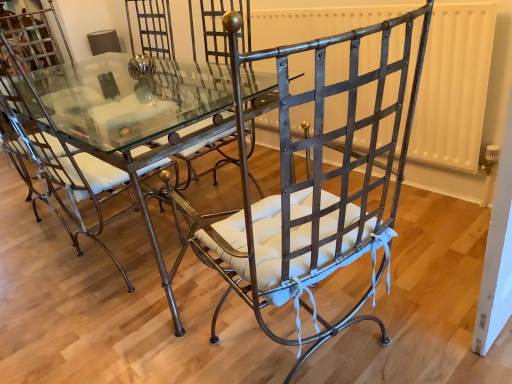
What is the approximate height of metallic wrought iron chair at center, which is the second chair in left-to-right order?

3.63 feet.

The height and width of the screenshot is (384, 512). Describe the element at coordinates (310, 185) in the screenshot. I see `metallic wrought iron chair at center, positioned as the first chair in right-to-left order` at that location.

This screenshot has height=384, width=512. Find the location of `clear glass table at center`. clear glass table at center is located at coordinates (118, 127).

Image resolution: width=512 pixels, height=384 pixels. Identify the location of wrought iron chair at center, which is the 1th chair from left to right. (61, 163).

Between point (339, 240) and point (116, 92), which one is positioned behind?

The point (116, 92) is farther.

From the image's perspective, relative to clear glass table at center, is metallic wrought iron chair at center, positioned as the first chair in right-to-left order, above or below?

metallic wrought iron chair at center, positioned as the first chair in right-to-left order, is situated lower than clear glass table at center in the image.

Considering their positions, is metallic wrought iron chair at center, positioned as the first chair in right-to-left order, located in front of or behind clear glass table at center?

Visually, metallic wrought iron chair at center, positioned as the first chair in right-to-left order, is located in front of clear glass table at center.

Considering the sizes of objects metallic wrought iron chair at center, positioned as the first chair in right-to-left order, and clear glass table at center in the image provided, who is shorter, metallic wrought iron chair at center, positioned as the first chair in right-to-left order, or clear glass table at center?

With less height is clear glass table at center.

Can you confirm if wrought iron chair at center, which is the 1th chair from left to right, is thinner than metallic wrought iron chair at center, which is the second chair in left-to-right order?

In fact, wrought iron chair at center, which is the 1th chair from left to right, might be wider than metallic wrought iron chair at center, which is the second chair in left-to-right order.

From the image's perspective, would you say wrought iron chair at center, which ranks as the 2th chair in right-to-left order, is shown under metallic wrought iron chair at center, positioned as the first chair in right-to-left order?

No.

Is wrought iron chair at center, which ranks as the 2th chair in right-to-left order, taller or shorter than metallic wrought iron chair at center, which is the second chair in left-to-right order?

In the image, wrought iron chair at center, which ranks as the 2th chair in right-to-left order, appears to be shorter than metallic wrought iron chair at center, which is the second chair in left-to-right order.

Who is bigger, wrought iron chair at center, which is the 1th chair from left to right, or metallic wrought iron chair at center, positioned as the first chair in right-to-left order?

wrought iron chair at center, which is the 1th chair from left to right.

Who is bigger, metallic wrought iron chair at center, which is the second chair in left-to-right order, or wrought iron chair at center, which is the 1th chair from left to right?

wrought iron chair at center, which is the 1th chair from left to right, is bigger.

Visually, is metallic wrought iron chair at center, positioned as the first chair in right-to-left order, positioned to the left or to the right of wrought iron chair at center, which is the 1th chair from left to right?

Clearly, metallic wrought iron chair at center, positioned as the first chair in right-to-left order, is on the right of wrought iron chair at center, which is the 1th chair from left to right, in the image.

Which of these two, metallic wrought iron chair at center, positioned as the first chair in right-to-left order, or wrought iron chair at center, which ranks as the 2th chair in right-to-left order, is wider?

With larger width is wrought iron chair at center, which ranks as the 2th chair in right-to-left order.

I want to click on table that is on the right side of wrought iron chair at center, which ranks as the 2th chair in right-to-left order, so click(118, 127).

Considering the relative sizes of wrought iron chair at center, which is the 1th chair from left to right, and clear glass table at center in the image provided, is wrought iron chair at center, which is the 1th chair from left to right, bigger than clear glass table at center?

Actually, wrought iron chair at center, which is the 1th chair from left to right, might be smaller than clear glass table at center.

Is wrought iron chair at center, which is the 1th chair from left to right, at the left side of clear glass table at center?

Yes, wrought iron chair at center, which is the 1th chair from left to right, is to the left of clear glass table at center.

Is wrought iron chair at center, which is the 1th chair from left to right, completely or partially outside of clear glass table at center?

That's incorrect, wrought iron chair at center, which is the 1th chair from left to right, is not completely outside clear glass table at center.

Considering the sizes of objects clear glass table at center and metallic wrought iron chair at center, positioned as the first chair in right-to-left order, in the image provided, who is wider, clear glass table at center or metallic wrought iron chair at center, positioned as the first chair in right-to-left order,?

clear glass table at center is wider.

Does clear glass table at center appear on the left side of metallic wrought iron chair at center, positioned as the first chair in right-to-left order?

Yes.

Identify the location of table behind the metallic wrought iron chair at center, positioned as the first chair in right-to-left order. This screenshot has height=384, width=512. (118, 127).

Considering the positions of points (177, 109) and (51, 140), is point (177, 109) farther from camera compared to point (51, 140)?

Yes, point (177, 109) is behind point (51, 140).

From the picture: Considering the relative positions of clear glass table at center and wrought iron chair at center, which ranks as the 2th chair in right-to-left order, in the image provided, is clear glass table at center to the left or to the right of wrought iron chair at center, which ranks as the 2th chair in right-to-left order,?

From the image, it's evident that clear glass table at center is to the right of wrought iron chair at center, which ranks as the 2th chair in right-to-left order.

From a real-world perspective, between clear glass table at center and wrought iron chair at center, which ranks as the 2th chair in right-to-left order, who is vertically lower?

clear glass table at center is physically lower.

Can you confirm if clear glass table at center is smaller than wrought iron chair at center, which ranks as the 2th chair in right-to-left order?

No, clear glass table at center is not smaller than wrought iron chair at center, which ranks as the 2th chair in right-to-left order.

I want to click on table on the left of the metallic wrought iron chair at center, positioned as the first chair in right-to-left order, so pyautogui.click(x=118, y=127).

The height and width of the screenshot is (384, 512). I want to click on chair above the metallic wrought iron chair at center, which is the second chair in left-to-right order (from the image's perspective), so click(x=61, y=163).

When comparing their distances from clear glass table at center, does metallic wrought iron chair at center, positioned as the first chair in right-to-left order, or wrought iron chair at center, which ranks as the 2th chair in right-to-left order, seem closer?

wrought iron chair at center, which ranks as the 2th chair in right-to-left order, is positioned closer to the anchor clear glass table at center.

Which object lies nearer to the anchor point metallic wrought iron chair at center, which is the second chair in left-to-right order, wrought iron chair at center, which ranks as the 2th chair in right-to-left order, or clear glass table at center?

wrought iron chair at center, which ranks as the 2th chair in right-to-left order, is positioned closer to the anchor metallic wrought iron chair at center, which is the second chair in left-to-right order.

Estimate the real-world distances between objects in this image. Which object is further from clear glass table at center, wrought iron chair at center, which ranks as the 2th chair in right-to-left order, or metallic wrought iron chair at center, which is the second chair in left-to-right order?

The object further to clear glass table at center is metallic wrought iron chair at center, which is the second chair in left-to-right order.

Estimate the real-world distances between objects in this image. Which object is closer to wrought iron chair at center, which ranks as the 2th chair in right-to-left order, clear glass table at center or metallic wrought iron chair at center, which is the second chair in left-to-right order?

clear glass table at center lies closer to wrought iron chair at center, which ranks as the 2th chair in right-to-left order, than the other object.

When comparing their distances from wrought iron chair at center, which is the 1th chair from left to right, does metallic wrought iron chair at center, positioned as the first chair in right-to-left order, or clear glass table at center seem closer?

Among the two, clear glass table at center is located nearer to wrought iron chair at center, which is the 1th chair from left to right.

Estimate the real-world distances between objects in this image. Which object is further from metallic wrought iron chair at center, which is the second chair in left-to-right order, clear glass table at center or wrought iron chair at center, which is the 1th chair from left to right?

Based on the image, clear glass table at center appears to be further to metallic wrought iron chair at center, which is the second chair in left-to-right order.

At what (x,y) coordinates should I click in order to perform the action: click on table between wrought iron chair at center, which ranks as the 2th chair in right-to-left order, and metallic wrought iron chair at center, which is the second chair in left-to-right order. Please return your answer as a coordinate pair (x, y). Looking at the image, I should click on (118, 127).